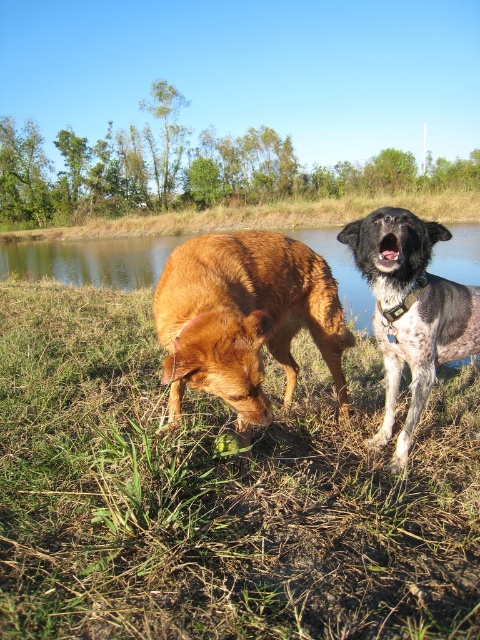
Question: Is green grass at center closer to camera compared to golden brown fur at lower left?

Choices:
 (A) yes
 (B) no

Answer: (B)

Question: Is green grass at center to the right of golden brown fur at lower left from the viewer's perspective?

Choices:
 (A) yes
 (B) no

Answer: (A)

Question: Which point appears farthest from the camera in this image?

Choices:
 (A) (424, 547)
 (B) (252, 380)
 (C) (456, 292)

Answer: (C)

Question: Is green grass at center thinner than golden brown fur at lower left?

Choices:
 (A) yes
 (B) no

Answer: (B)

Question: Which object is positioned closest to the green grass at center?

Choices:
 (A) speckled fur dog at right
 (B) golden brown fur at lower left

Answer: (B)

Question: Which of the following is the farthest from the observer?

Choices:
 (A) green grass at center
 (B) golden brown fur at lower left

Answer: (A)